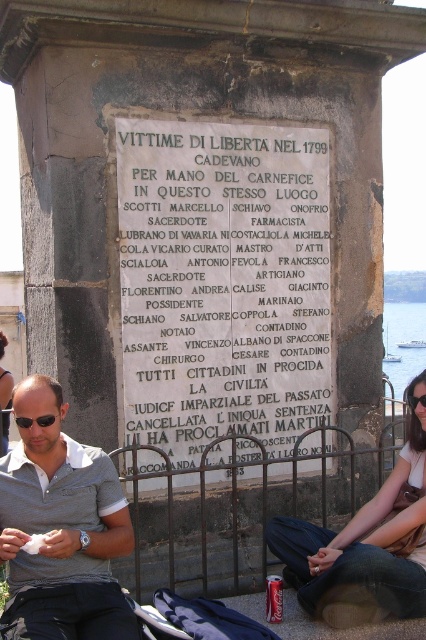
Who is positioned more to the right, gray polo shirt at center or denim jeans at lower right?

From the viewer's perspective, denim jeans at lower right appears more on the right side.

Is gray polo shirt at center further to the viewer compared to denim jeans at lower right?

No, it is in front of denim jeans at lower right.

Is point (52, 499) farther from viewer compared to point (420, 438)?

No, (52, 499) is closer to viewer.

Find the location of a particular element. The height and width of the screenshot is (640, 426). gray polo shirt at center is located at coordinates (62, 529).

Is point (241, 140) positioned behind point (365, 538)?

Yes, point (241, 140) is farther from viewer.

Does white stone plaque at center have a lesser height compared to denim jeans at lower right?

Incorrect, white stone plaque at center's height does not fall short of denim jeans at lower right's.

Is point (238, 403) more distant than point (290, 529)?

Yes, it is behind point (290, 529).

The image size is (426, 640). I want to click on white stone plaque at center, so click(x=222, y=282).

Describe the element at coordinates (365, 545) in the screenshot. I see `denim jeans at lower right` at that location.

Does denim jeans at lower right have a larger size compared to black plastic sunglasses at lower left?

Indeed, denim jeans at lower right has a larger size compared to black plastic sunglasses at lower left.

Does point (353, 572) lie in front of point (46, 416)?

Yes.

Locate an element on the screen. The width and height of the screenshot is (426, 640). denim jeans at lower right is located at coordinates (365, 545).